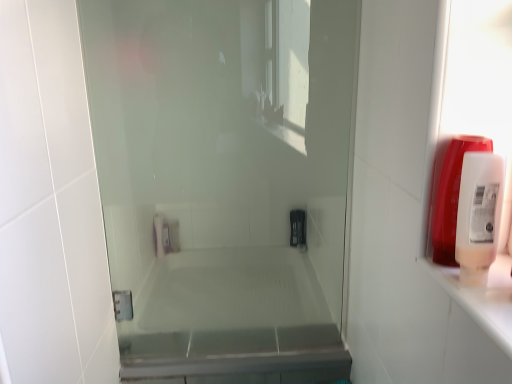
Question: Can you confirm if translucent plastic soap dispenser at right, which is the 2th soap dispenser in front-to-back order, is smaller than white plastic soap dispenser at right, placed as the 1th soap dispenser when sorted from front to back?

Choices:
 (A) no
 (B) yes

Answer: (A)

Question: Considering the relative sizes of translucent plastic soap dispenser at right, which is the 2th soap dispenser in front-to-back order, and white plastic soap dispenser at right, the 2th soap dispenser when ordered from back to front, in the image provided, is translucent plastic soap dispenser at right, which is the 2th soap dispenser in front-to-back order, wider than white plastic soap dispenser at right, the 2th soap dispenser when ordered from back to front,?

Choices:
 (A) no
 (B) yes

Answer: (A)

Question: Is translucent plastic soap dispenser at right, the 1th soap dispenser in the back-to-front sequence, in front of white plastic soap dispenser at right, placed as the 1th soap dispenser when sorted from front to back?

Choices:
 (A) no
 (B) yes

Answer: (A)

Question: Can you confirm if translucent plastic soap dispenser at right, the 1th soap dispenser in the back-to-front sequence, is thinner than white plastic soap dispenser at right, the 2th soap dispenser when ordered from back to front?

Choices:
 (A) no
 (B) yes

Answer: (B)

Question: Is translucent plastic soap dispenser at right, the 1th soap dispenser in the back-to-front sequence, outside white plastic soap dispenser at right, placed as the 1th soap dispenser when sorted from front to back?

Choices:
 (A) yes
 (B) no

Answer: (A)

Question: From their relative heights in the image, would you say translucent plastic soap dispenser at right, which is the 2th soap dispenser in front-to-back order, is taller or shorter than white plastic soap dispenser at right, the 2th soap dispenser when ordered from back to front?

Choices:
 (A) short
 (B) tall

Answer: (B)

Question: Considering the positions of point (431, 211) and point (482, 208), is point (431, 211) closer or farther from the camera than point (482, 208)?

Choices:
 (A) farther
 (B) closer

Answer: (A)

Question: From the image's perspective, is translucent plastic soap dispenser at right, which is the 2th soap dispenser in front-to-back order, located above or below white plastic soap dispenser at right, the 2th soap dispenser when ordered from back to front?

Choices:
 (A) below
 (B) above

Answer: (B)

Question: Visually, is translucent plastic soap dispenser at right, the 1th soap dispenser in the back-to-front sequence, positioned to the left or to the right of white plastic soap dispenser at right, the 2th soap dispenser when ordered from back to front?

Choices:
 (A) left
 (B) right

Answer: (B)

Question: From their relative heights in the image, would you say white plastic soap dispenser at right, placed as the 1th soap dispenser when sorted from front to back, is taller or shorter than transparent glass shower door at center?

Choices:
 (A) tall
 (B) short

Answer: (B)

Question: From a real-world perspective, is white plastic soap dispenser at right, the 2th soap dispenser when ordered from back to front, physically located above or below transparent glass shower door at center?

Choices:
 (A) above
 (B) below

Answer: (A)

Question: Considering the relative positions of white plastic soap dispenser at right, placed as the 1th soap dispenser when sorted from front to back, and transparent glass shower door at center in the image provided, is white plastic soap dispenser at right, placed as the 1th soap dispenser when sorted from front to back, to the left or to the right of transparent glass shower door at center?

Choices:
 (A) left
 (B) right

Answer: (B)

Question: In terms of width, does white plastic soap dispenser at right, the 2th soap dispenser when ordered from back to front, look wider or thinner when compared to transparent glass shower door at center?

Choices:
 (A) wide
 (B) thin

Answer: (A)

Question: In terms of size, does white plastic soap dispenser at right, the 2th soap dispenser when ordered from back to front, appear bigger or smaller than translucent plastic soap dispenser at right, the 1th soap dispenser in the back-to-front sequence?

Choices:
 (A) small
 (B) big

Answer: (A)

Question: Is white plastic soap dispenser at right, placed as the 1th soap dispenser when sorted from front to back, to the left or to the right of translucent plastic soap dispenser at right, the 1th soap dispenser in the back-to-front sequence, in the image?

Choices:
 (A) right
 (B) left

Answer: (B)